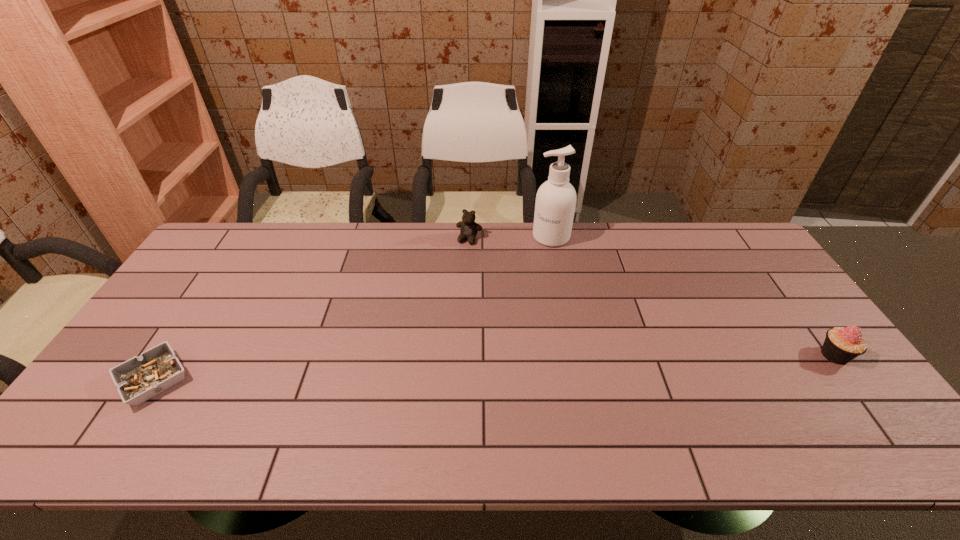
Locate an element on the screen. vacant space located on the face of the second object from left to right is located at coordinates (x=440, y=303).

Image resolution: width=960 pixels, height=540 pixels. What are the coordinates of `vacant region located on the front label of the third object from left to right` in the screenshot? It's located at (506, 307).

I want to click on free region located on the front label of the third object from left to right, so click(x=519, y=286).

Locate an element on the screen. Image resolution: width=960 pixels, height=540 pixels. vacant space situated 0.310m on the front label of the third object from left to right is located at coordinates (508, 305).

The image size is (960, 540). In order to click on teddy bear that is at the far edge in this screenshot , I will do `click(468, 227)`.

Where is `cleansing agent present at the far edge`? cleansing agent present at the far edge is located at coordinates (555, 204).

Locate an element on the screen. Image resolution: width=960 pixels, height=540 pixels. object present at the near edge is located at coordinates (138, 379).

This screenshot has height=540, width=960. Find the location of `object located in the left edge section of the desktop`. object located in the left edge section of the desktop is located at coordinates (138, 379).

I want to click on object that is at the right edge, so click(x=841, y=345).

Where is `object that is at the near left corner`? The width and height of the screenshot is (960, 540). object that is at the near left corner is located at coordinates (138, 379).